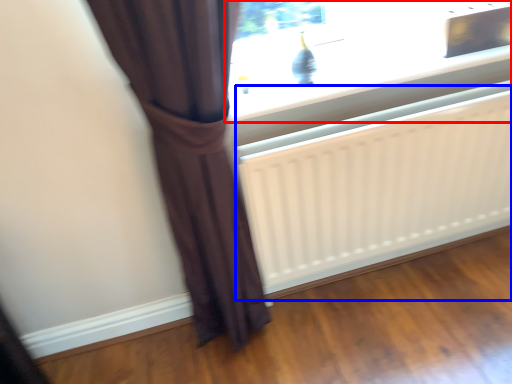
Question: Which object appears closest to the camera in this image, window (highlighted by a red box) or radiator (highlighted by a blue box)?

Choices:
 (A) window
 (B) radiator

Answer: (B)